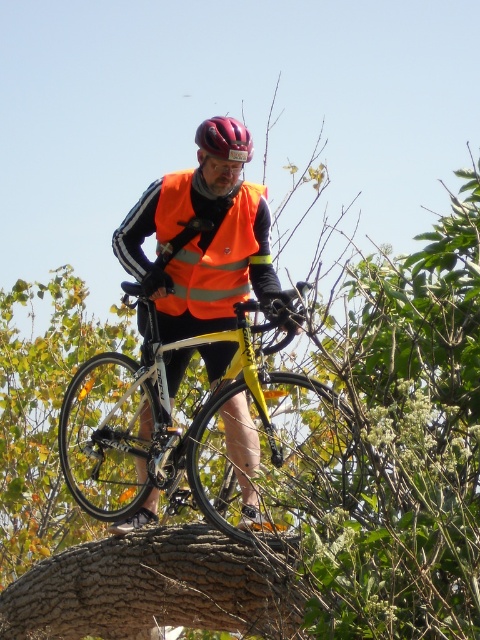
Between yellow matte bicycle at center and matte black helmet at center, which one has more height?

Standing taller between the two is yellow matte bicycle at center.

Can you confirm if yellow matte bicycle at center is taller than matte black helmet at center?

Correct, yellow matte bicycle at center is much taller as matte black helmet at center.

Does point (124, 381) come behind point (213, 138)?

Yes, point (124, 381) is farther from viewer.

Find the location of `yellow matte bicycle at center`. yellow matte bicycle at center is located at coordinates (206, 435).

Does yellow matte bicycle at center have a greater height compared to brown rough tree trunk at center?

Yes, yellow matte bicycle at center is taller than brown rough tree trunk at center.

Does yellow matte bicycle at center appear on the left side of brown rough tree trunk at center?

No, yellow matte bicycle at center is not to the left of brown rough tree trunk at center.

Measure the distance between yellow matte bicycle at center and camera.

They are 8.47 meters apart.

Where is `yellow matte bicycle at center`? yellow matte bicycle at center is located at coordinates (206, 435).

Is yellow matte bicycle at center closer to the viewer compared to orange reflective vest at center?

Yes, yellow matte bicycle at center is in front of orange reflective vest at center.

Does yellow matte bicycle at center appear over orange reflective vest at center?

Actually, yellow matte bicycle at center is below orange reflective vest at center.

Which is behind, point (167, 486) or point (202, 269)?

The point (202, 269) is more distant.

Find the location of `yellow matte bicycle at center`. yellow matte bicycle at center is located at coordinates (206, 435).